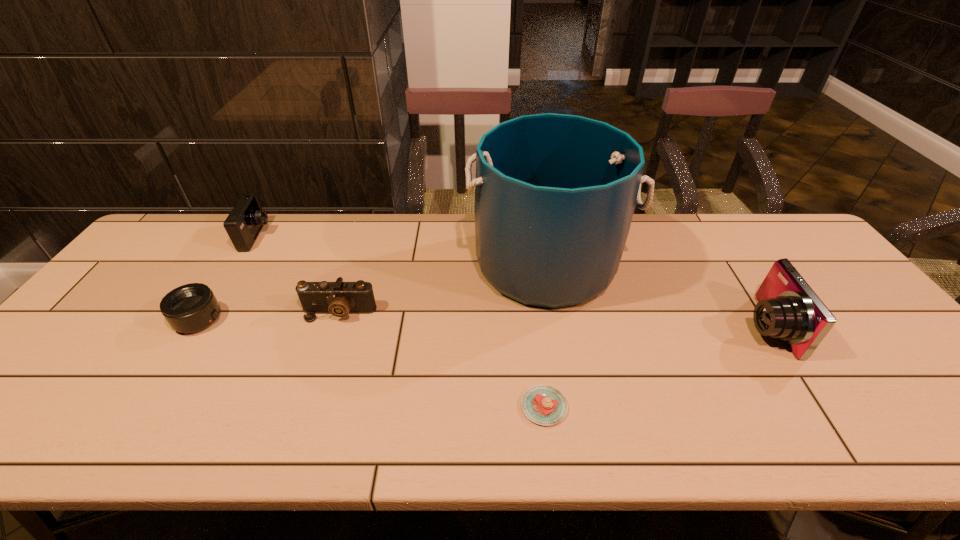
Locate an element on the screen. This screenshot has width=960, height=540. bucket is located at coordinates (555, 194).

This screenshot has width=960, height=540. What are the coordinates of `the tallest camera` in the screenshot? It's located at (788, 309).

I want to click on the rightmost camera, so click(788, 309).

At what (x,y) coordinates should I click in order to perform the action: click on the leftmost camera. Please return your answer as a coordinate pair (x, y). This screenshot has width=960, height=540. Looking at the image, I should click on (244, 223).

At what (x,y) coordinates should I click in order to perform the action: click on the second tallest camera. Please return your answer as a coordinate pair (x, y). This screenshot has width=960, height=540. Looking at the image, I should click on (244, 223).

Locate an element on the screen. the shortest camera is located at coordinates (339, 298).

This screenshot has width=960, height=540. Identify the location of the third shortest object. tap(339, 298).

At what (x,y) coordinates should I click in order to perform the action: click on the fifth tallest object. Please return your answer as a coordinate pair (x, y). This screenshot has width=960, height=540. Looking at the image, I should click on (193, 307).

The image size is (960, 540). Identify the location of pastry. point(545,405).

This screenshot has height=540, width=960. Find the location of `the nearest object`. the nearest object is located at coordinates (545, 405).